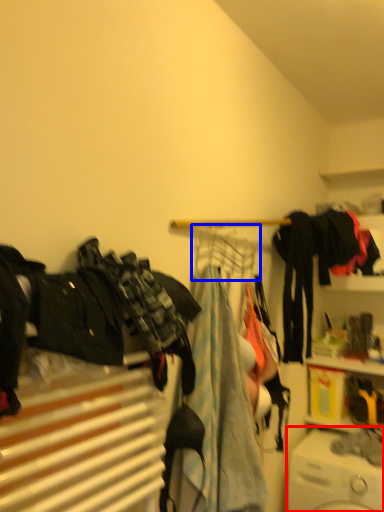
Question: Which of the following is the farthest to the observer, washing machine (highlighted by a red box) or clothesline (highlighted by a blue box)?

Choices:
 (A) washing machine
 (B) clothesline

Answer: (A)